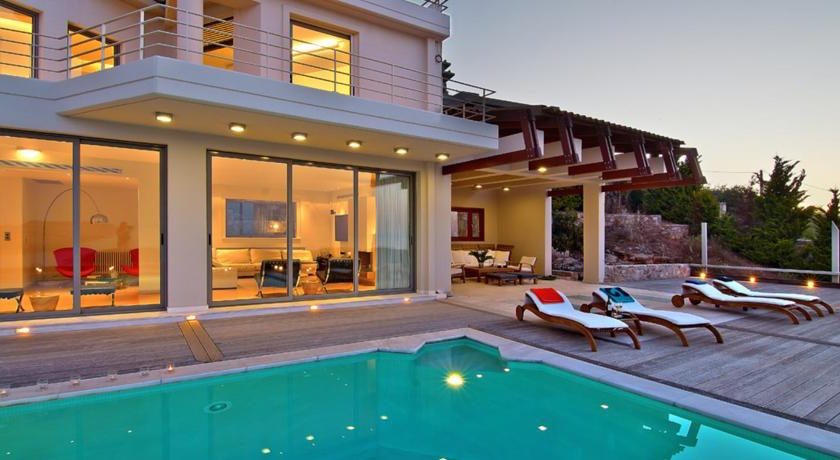
Where is `curtain`? This screenshot has width=840, height=460. curtain is located at coordinates (386, 250).